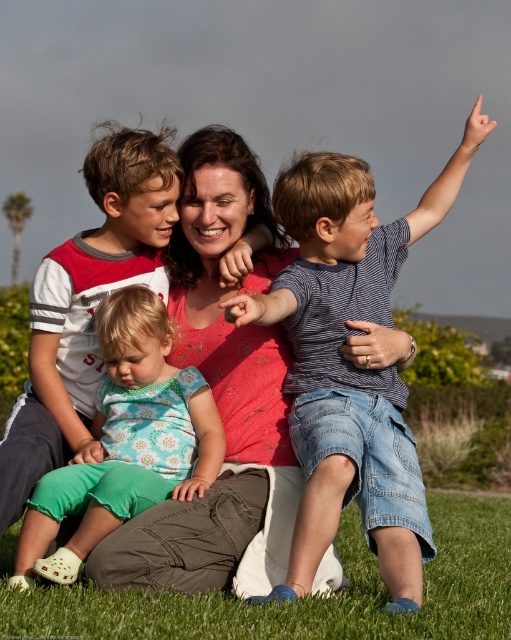
You are a photographer trying to capture the striped cotton shirt at right and the green grass at lower center in the same frame. Which object is higher in the image?

The striped cotton shirt at right is taller than the green grass at lower center, so the striped cotton shirt at right appears higher in the image.